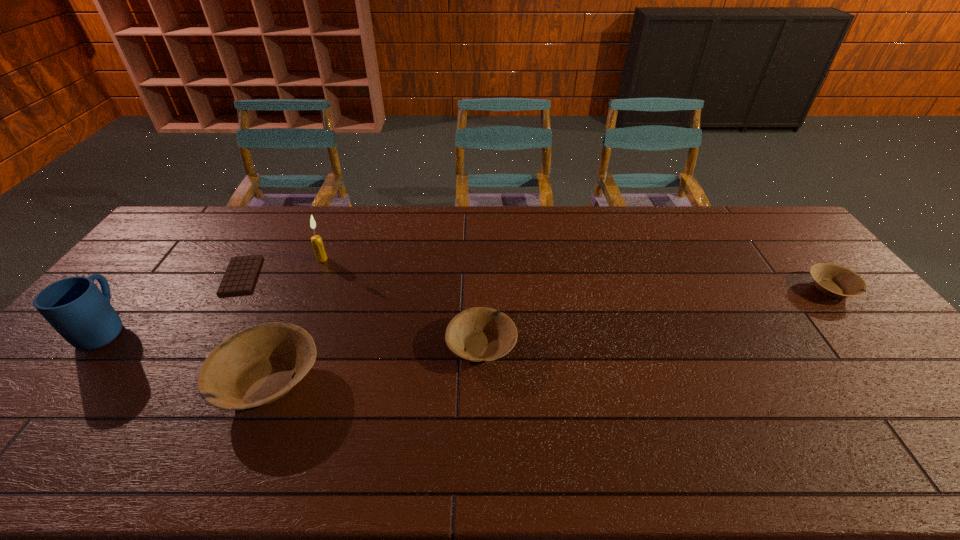
Where is `object that is at the right edge`? This screenshot has height=540, width=960. object that is at the right edge is located at coordinates (833, 280).

This screenshot has width=960, height=540. What are the coordinates of `vacant space at the far edge of the desktop` in the screenshot? It's located at (655, 219).

Identify the location of blank space at the near edge. The image size is (960, 540). (864, 411).

In the image, there is a desktop. Find the location of `free region at the left edge`. free region at the left edge is located at coordinates (156, 305).

The width and height of the screenshot is (960, 540). In the image, there is a desktop. Identify the location of vacant space at the right edge. (799, 288).

Where is `vacant point at the far left corner`? The width and height of the screenshot is (960, 540). vacant point at the far left corner is located at coordinates (211, 231).

Locate an element on the screen. This screenshot has width=960, height=540. free region at the far right corner is located at coordinates (775, 217).

Find the location of a particular element. Image resolution: width=960 pixels, height=540 pixels. empty space that is in between the candle and the second tallest bowl is located at coordinates pos(402,302).

Find the location of `free space that is in between the second bowl from right to left and the candle`. free space that is in between the second bowl from right to left and the candle is located at coordinates (402, 302).

Where is `free space between the fifth object from right to left and the shortest bowl`? free space between the fifth object from right to left and the shortest bowl is located at coordinates (536, 282).